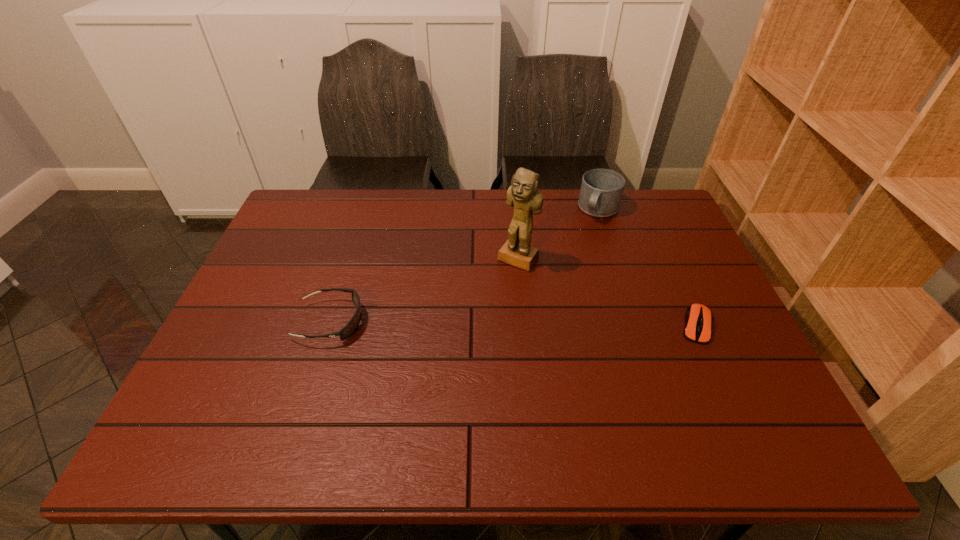
The image size is (960, 540). What are the coordinates of `free area in between the shortest object and the third nearest object` in the screenshot? It's located at (607, 293).

You are a GUI agent. You are given a task and a screenshot of the screen. Output one action in this format:
    pyautogui.click(x=<x>, y=<y>)
    Task: Click on the vacant region between the third shortest object and the rightmost object
    Image resolution: width=960 pixels, height=540 pixels.
    Given the screenshot: What is the action you would take?
    pyautogui.click(x=648, y=268)

Locate an element on the screen. The image size is (960, 540). vacant region between the mug and the tallest object is located at coordinates (559, 234).

At what (x,y) coordinates should I click in order to perform the action: click on free space between the tallest object and the goggles. Please return your answer as a coordinate pair (x, y). Looking at the image, I should click on (424, 291).

Identify which object is the second closest to the rightmost object. Please provide its 2D coordinates. Your answer should be formatted as a tuple, i.e. [(x, y)], where the tuple contains the x and y coordinates of a point satisfying the conditions above.

[(523, 194)]

The image size is (960, 540). In order to click on the second closest object to the second shortest object in this screenshot , I will do 601,191.

The width and height of the screenshot is (960, 540). I want to click on vacant area in the image that satisfies the following two spatial constraints: 1. on the back side of the third shortest object; 2. on the right side of the figurine, so click(514, 210).

In order to click on free location that satisfies the following two spatial constraints: 1. on the front side of the tallest object; 2. on the right side of the shortest object in this screenshot , I will do `click(524, 326)`.

Where is `free spot that satisfies the following two spatial constraints: 1. on the front side of the computer mouse; 2. on the right side of the figurine`? free spot that satisfies the following two spatial constraints: 1. on the front side of the computer mouse; 2. on the right side of the figurine is located at coordinates (524, 326).